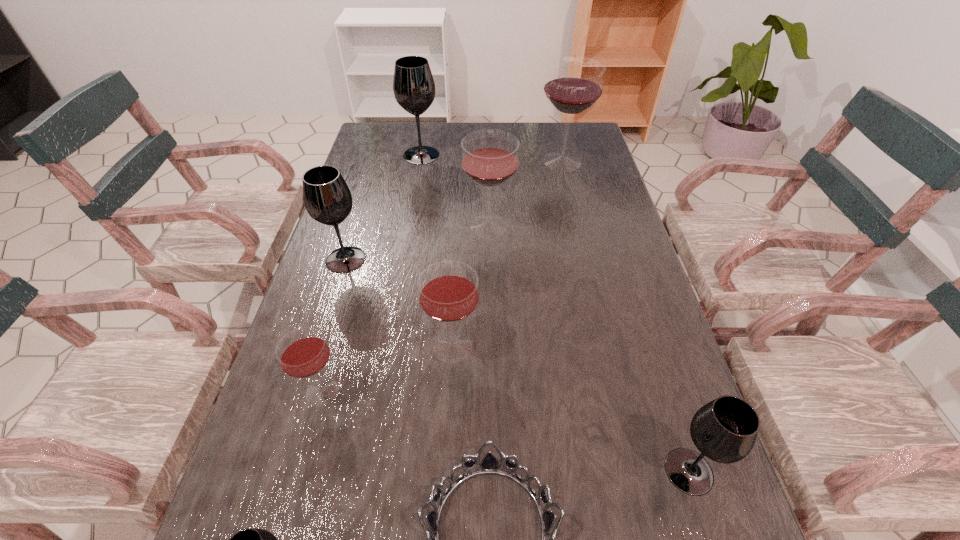
The height and width of the screenshot is (540, 960). What are the coordinates of `vacant space positioned 0.070m on the front of the sixth farthest object` in the screenshot? It's located at (306, 447).

Where is `object present at the far left corner`? object present at the far left corner is located at coordinates (414, 88).

Locate an element on the screen. object situated at the far right corner is located at coordinates (574, 84).

Find the location of a particular element. The image size is (960, 540). vacant region at the far edge is located at coordinates (462, 123).

Where is `free space at the left edge of the desktop`? The image size is (960, 540). free space at the left edge of the desktop is located at coordinates (351, 380).

Image resolution: width=960 pixels, height=540 pixels. Find the location of `free region at the right edge of the desktop`. free region at the right edge of the desktop is located at coordinates (665, 456).

Where is `vacant space at the far left corner of the desktop`? vacant space at the far left corner of the desktop is located at coordinates (389, 155).

This screenshot has height=540, width=960. Find the location of `free space that is in between the fourth nearest wineglass and the farthest gray wineglass`. free space that is in between the fourth nearest wineglass and the farthest gray wineglass is located at coordinates (437, 251).

I want to click on vacant space in between the leftmost red wineglass and the biggest gray wineglass, so click(x=372, y=273).

Identify the location of free space between the farthest red wineglass and the fourth nearest wineglass. tap(508, 254).